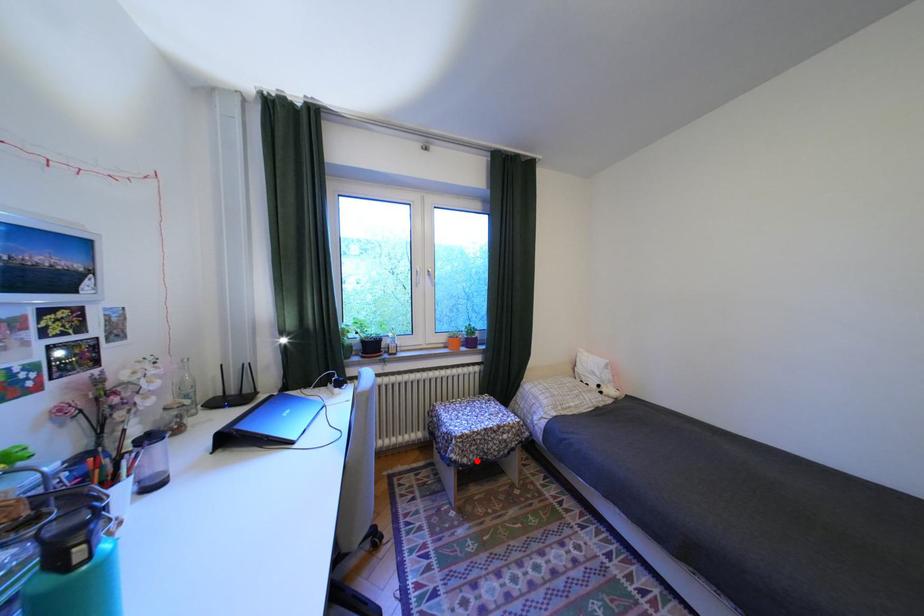
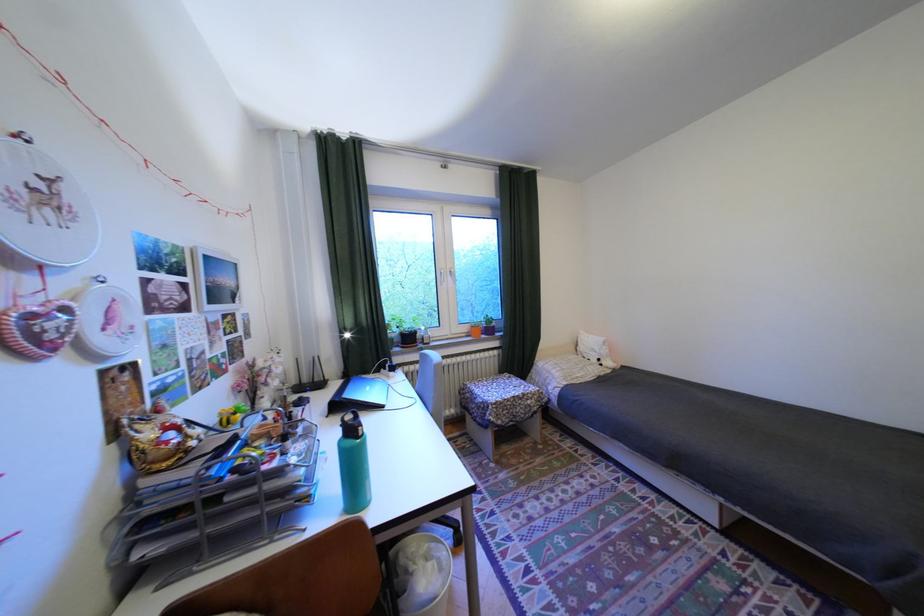
Where in the second image is the point corresponding to the highlighted location from the first image?

(512, 422)